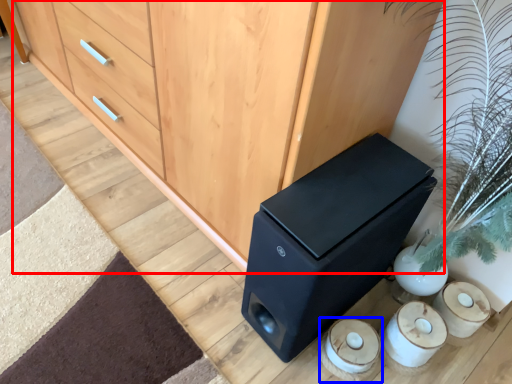
Question: Which of the following is the closest to the observer, chest of drawers (highlighted by a red box) or candle holder (highlighted by a blue box)?

Choices:
 (A) chest of drawers
 (B) candle holder

Answer: (A)